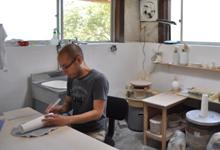
The image size is (220, 150). I want to click on surfaces to put things on, so click(x=62, y=140), click(x=167, y=97), click(x=143, y=82), click(x=188, y=65), click(x=194, y=97).